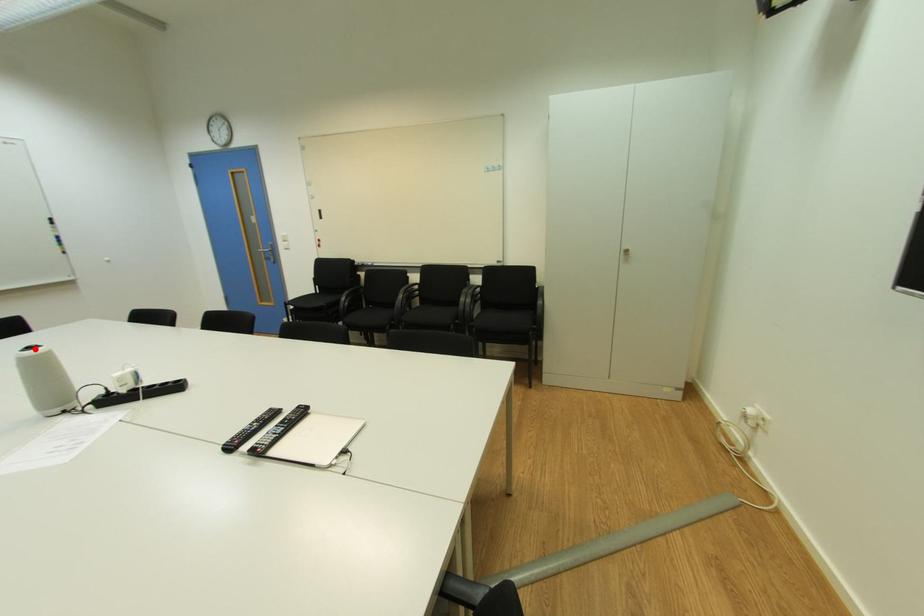
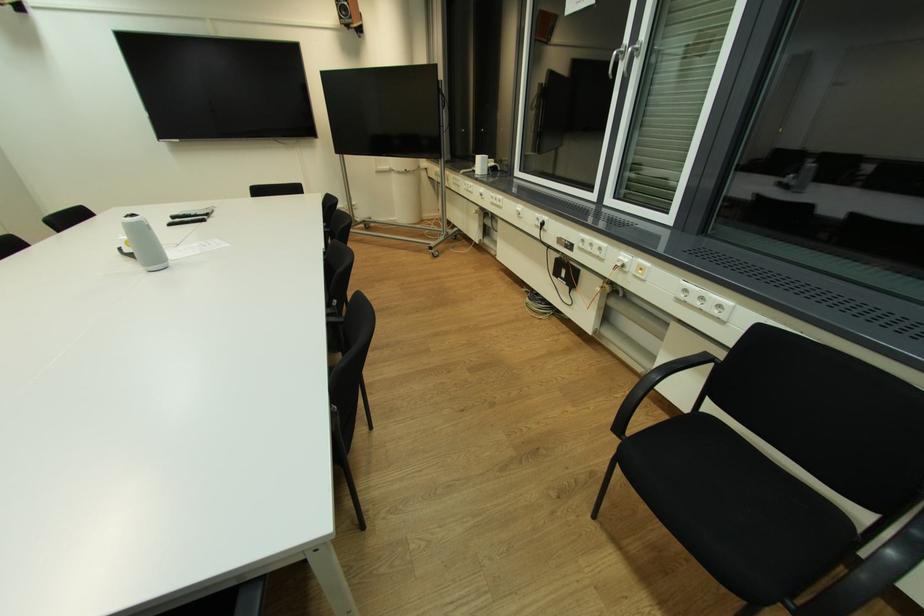
Question: I am providing you with two images of the same scene from different viewpoints. In image1, a red point is highlighted. Considering the same 3D point in image2, which of the following is correct?

Choices:
 (A) It is closer
 (B) It is farther

Answer: (B)